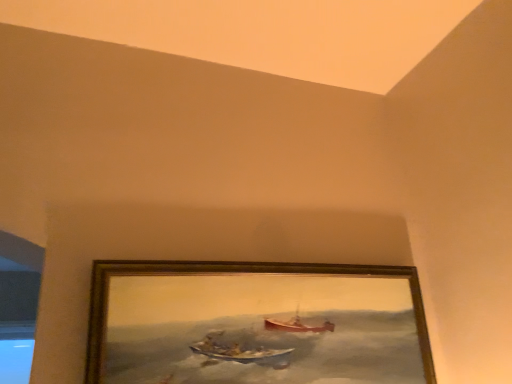
What do you see at coordinates (256, 324) in the screenshot?
I see `wooden frame at center` at bounding box center [256, 324].

Where is `wooden frame at center`? The height and width of the screenshot is (384, 512). wooden frame at center is located at coordinates (256, 324).

Locate an element on the screen. This screenshot has height=384, width=512. wooden frame at center is located at coordinates click(256, 324).